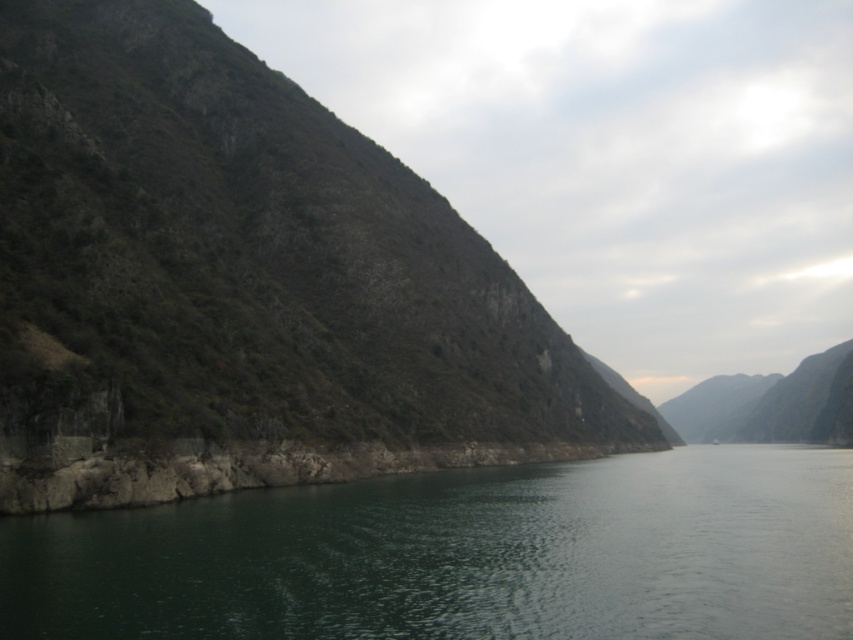
You are a photographer standing at the boat in the foreground. You want to capture a photo of the green rocky mountain at left and the green smooth water at center. Which object will appear higher in your photo?

The green rocky mountain at left will appear higher in the photo because it is located above the green smooth water at center.

You are standing at the edge of the cliff and want to take a photo of both the point at coordinates [280,259] and the point at coordinates [474,611] on the water. Which point will appear closer to you in the photo?

The point at coordinates [280,259] will appear closer to you in the photo because it is further to the viewer than the point at coordinates [474,611].